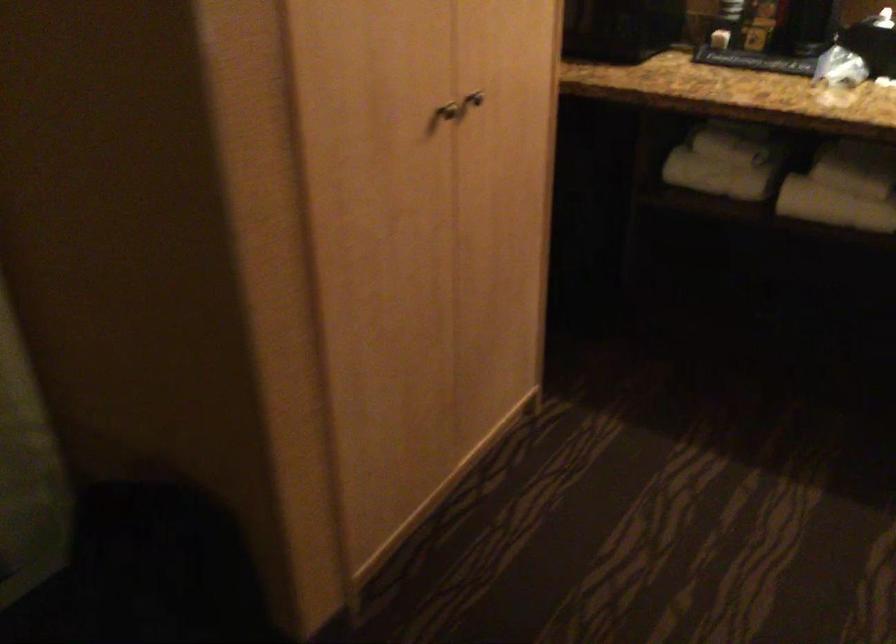
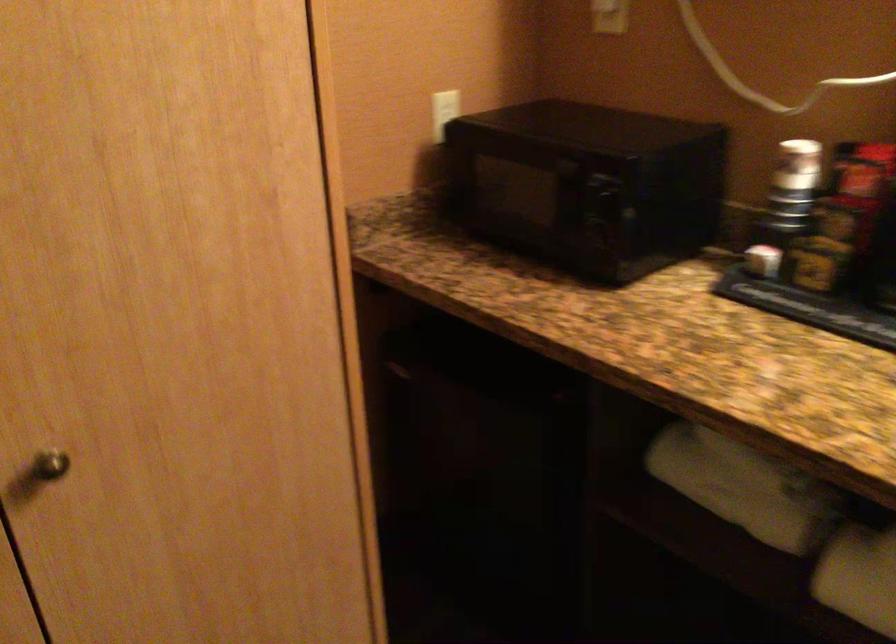
Find the pixel in the second image that matches point 746,180 in the first image.

(764, 509)